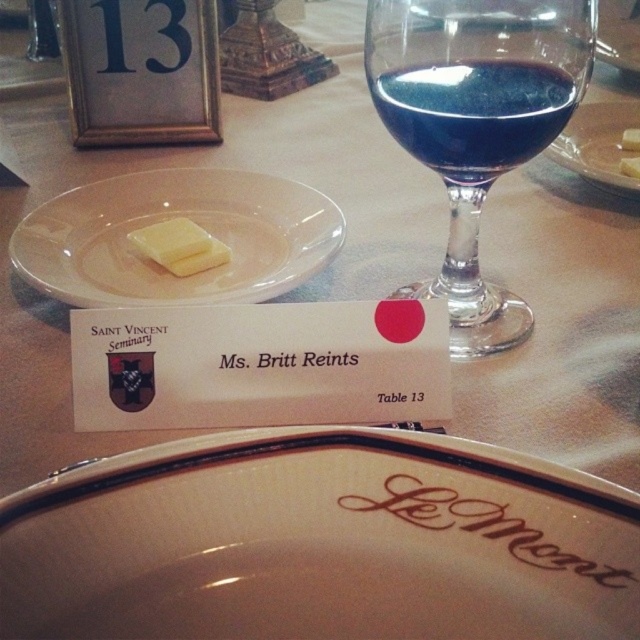
Does white glass plate at upper left have a smaller size compared to clear glass plate at center?

Indeed, white glass plate at upper left has a smaller size compared to clear glass plate at center.

Who is higher up, white glass plate at upper left or clear glass plate at center?

clear glass plate at center is above.

Between point (161, 189) and point (556, 145), which one is positioned behind?

The point (556, 145) is more distant.

Identify the location of white glass plate at upper left. Image resolution: width=640 pixels, height=640 pixels. (173, 218).

Does white glossy platter at center appear on the left side of yellow creamy butter at center?

No, white glossy platter at center is not to the left of yellow creamy butter at center.

Can you confirm if white glossy platter at center is positioned to the right of yellow creamy butter at center?

Indeed, white glossy platter at center is positioned on the right side of yellow creamy butter at center.

Is point (492, 449) closer to camera compared to point (154, 244)?

Yes, point (492, 449) is closer to viewer.

Where is `white glossy platter at center`? Image resolution: width=640 pixels, height=640 pixels. white glossy platter at center is located at coordinates (321, 541).

Who is more distant from viewer, (321,490) or (545,90)?

Point (545,90)

Is white glossy platter at center closer to the viewer compared to blue glass wine at upper center?

Yes, white glossy platter at center is in front of blue glass wine at upper center.

Does point (307, 488) come in front of point (449, 118)?

Yes, it is.

This screenshot has width=640, height=640. What are the coordinates of `white glossy platter at center` in the screenshot? It's located at (321, 541).